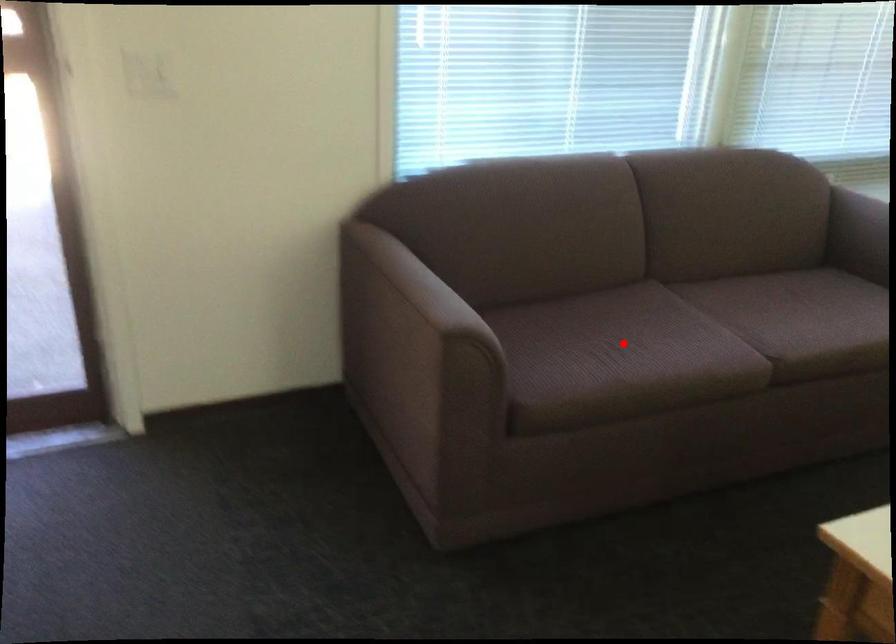
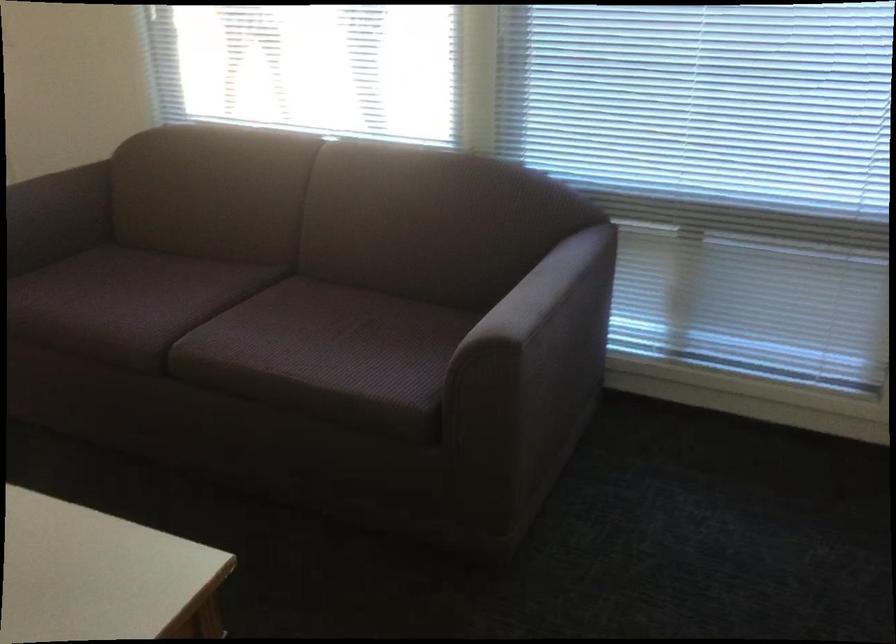
Find the pixel in the second image that matches the highlighted location in the first image.

(126, 299)